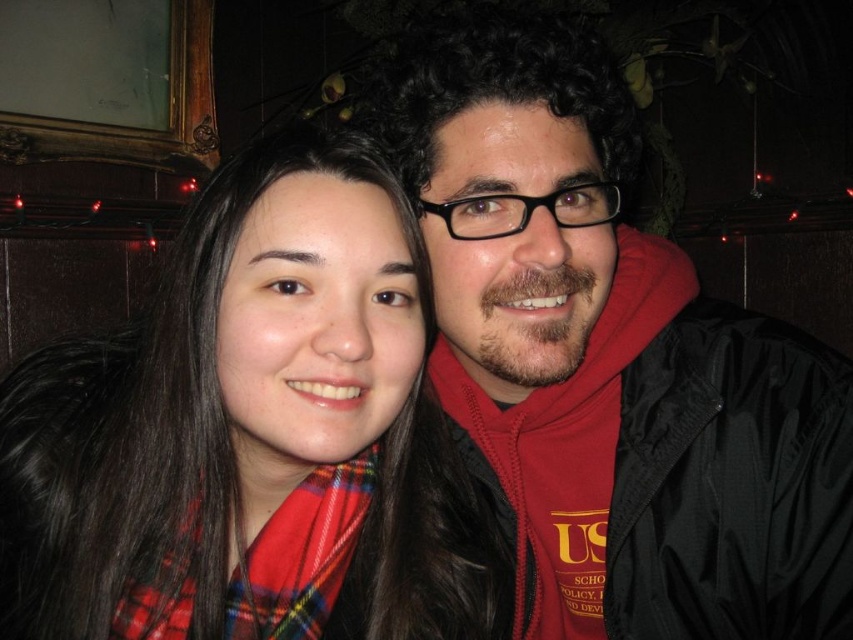
You are a photographer adjusting the lighting for a portrait. You need to ensure that the black matte jacket at right and the plaid scarf at left are both well lit. Given their positions and sizes, which object might require more focused lighting adjustments to ensure it stands out in the photo?

The black matte jacket at right might be wider than the plaid scarf at left, so it might require more focused lighting adjustments to ensure it stands out in the photo.

From the picture: You are a photographer holding a camera and want to take a closeup shot of the black matte jacket at right without moving the camera. Can you do it?

The black matte jacket at right and camera are 22.13 inches apart from each other, so yes, you can take a closeup shot of the black matte jacket at right without moving the camera as the distance is manageable for a closeup.

In the scene shown: You are standing in front of a photo taken in a cozy indoor setting with two people. The photo includes a point at coordinates point[656,484]. If you want to know how far this point is from the camera, what would you need to measure?

The distance of point[656,484] from the camera is 27.39 inches.